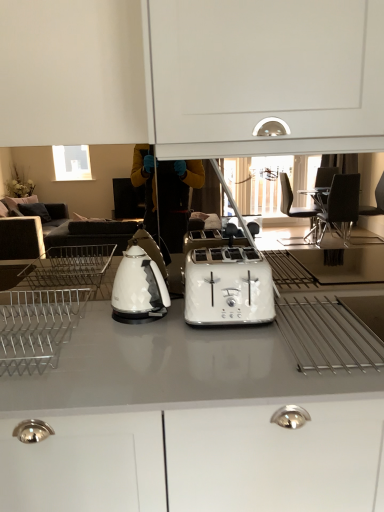
Question: Should I look upward or downward to see metallic silver dish rack at left?

Choices:
 (A) down
 (B) up

Answer: (A)

Question: Could you tell me if white glossy toaster at center is facing white glossy countertop at center?

Choices:
 (A) no
 (B) yes

Answer: (A)

Question: Does white glossy toaster at center have a larger size compared to white glossy countertop at center?

Choices:
 (A) no
 (B) yes

Answer: (A)

Question: Does white glossy toaster at center appear on the right side of white glossy countertop at center?

Choices:
 (A) no
 (B) yes

Answer: (B)

Question: Can you confirm if white glossy toaster at center is shorter than white glossy countertop at center?

Choices:
 (A) yes
 (B) no

Answer: (A)

Question: From the image's perspective, is white glossy toaster at center on top of white glossy countertop at center?

Choices:
 (A) yes
 (B) no

Answer: (A)

Question: Does white glossy toaster at center lie behind white glossy countertop at center?

Choices:
 (A) no
 (B) yes

Answer: (B)

Question: Does white glossy countertop at center lie in front of white glossy toaster at center?

Choices:
 (A) no
 (B) yes

Answer: (B)

Question: From the image's perspective, is white glossy countertop at center located beneath white glossy toaster at center?

Choices:
 (A) yes
 (B) no

Answer: (A)

Question: Is white glossy countertop at center shorter than white glossy toaster at center?

Choices:
 (A) no
 (B) yes

Answer: (A)

Question: Considering the relative sizes of white glossy countertop at center and white glossy toaster at center in the image provided, is white glossy countertop at center thinner than white glossy toaster at center?

Choices:
 (A) no
 (B) yes

Answer: (A)

Question: Is the position of white glossy countertop at center more distant than that of white glossy toaster at center?

Choices:
 (A) no
 (B) yes

Answer: (A)

Question: Is white glossy countertop at center facing towards white glossy toaster at center?

Choices:
 (A) no
 (B) yes

Answer: (A)

Question: Is there a large distance between white glossy toaster at center and metallic silver dish rack at left?

Choices:
 (A) no
 (B) yes

Answer: (A)